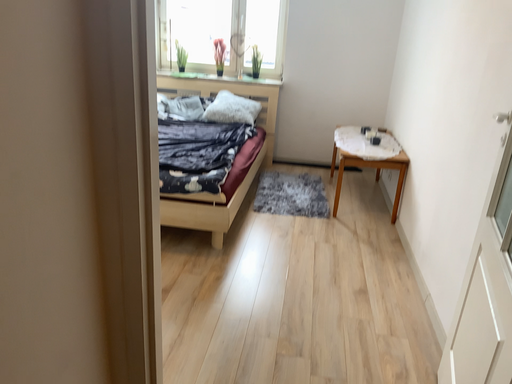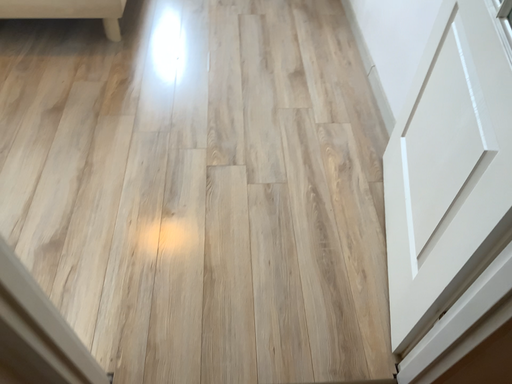
Question: How did the camera likely rotate when shooting the video?

Choices:
 (A) rotated downward
 (B) rotated upward

Answer: (A)